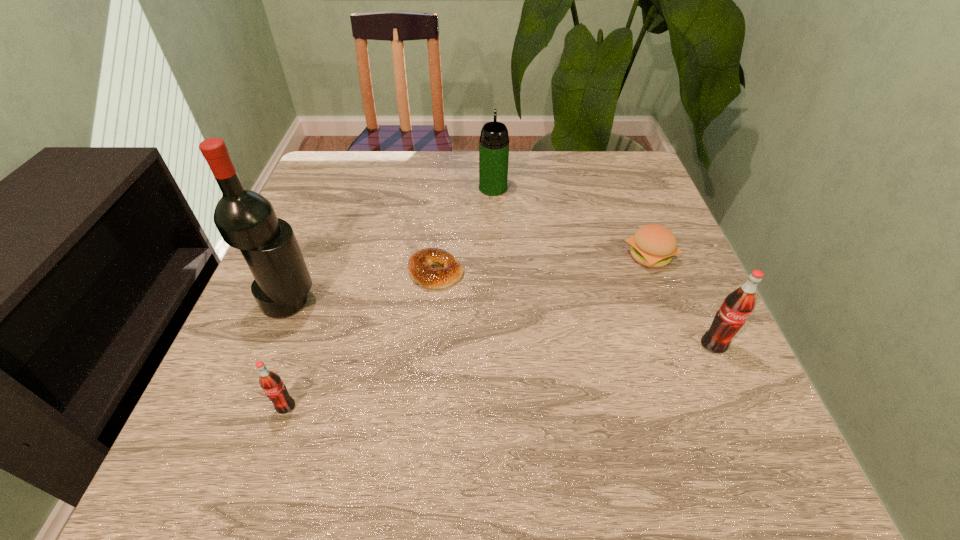
The height and width of the screenshot is (540, 960). In order to click on the left soda bottle in this screenshot , I will do `click(271, 383)`.

The width and height of the screenshot is (960, 540). What are the coordinates of `the shorter soda bottle` in the screenshot? It's located at (x=271, y=383).

This screenshot has height=540, width=960. I want to click on the second nearest object, so (738, 305).

The width and height of the screenshot is (960, 540). Identify the location of the right soda bottle. point(738,305).

Find the location of a particular element. This screenshot has height=540, width=960. the farthest object is located at coordinates (494, 141).

Locate an element on the screen. The height and width of the screenshot is (540, 960). thermos bottle is located at coordinates (494, 141).

Find the location of `wine bottle`. wine bottle is located at coordinates (246, 220).

Locate an element on the screen. The image size is (960, 540). the fifth tallest object is located at coordinates (653, 245).

In order to click on the fourth object from right to left in this screenshot , I will do `click(419, 265)`.

Locate an element on the screen. bagel is located at coordinates (419, 265).